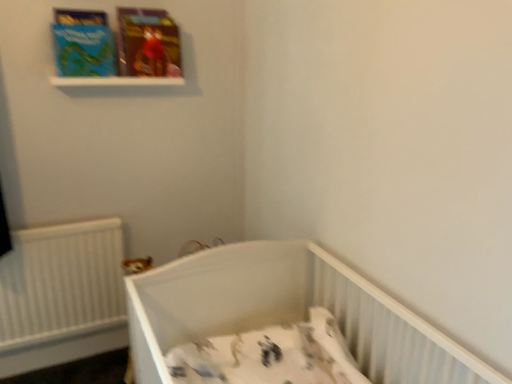
Question: Is matte cardboard book at upper left, which ranks as the first paperback book in right-to-left order, in front of or behind matte blue paperback book at upper left, which is counted as the 1th paperback book, starting from the left, in the image?

Choices:
 (A) behind
 (B) front

Answer: (A)

Question: Considering the positions of matte cardboard book at upper left, which ranks as the first paperback book in right-to-left order, and matte blue paperback book at upper left, which is counted as the 2th paperback book, starting from the right, in the image, is matte cardboard book at upper left, which ranks as the first paperback book in right-to-left order, wider or thinner than matte blue paperback book at upper left, which is counted as the 2th paperback book, starting from the right,?

Choices:
 (A) thin
 (B) wide

Answer: (B)

Question: Estimate the real-world distances between objects in this image. Which object is closer to the matte blue paperback book at upper left, which is counted as the 1th paperback book, starting from the left?

Choices:
 (A) matte cardboard book at upper left, the 2th paperback book when ordered from left to right
 (B) white plastic crib at lower center
 (C) white plastic balustrade at upper center

Answer: (C)

Question: Estimate the real-world distances between objects in this image. Which object is farther from the matte cardboard book at upper left, the 2th paperback book when ordered from left to right?

Choices:
 (A) white plastic balustrade at upper center
 (B) white plastic crib at lower center
 (C) matte blue paperback book at upper left, which is counted as the 1th paperback book, starting from the left

Answer: (B)